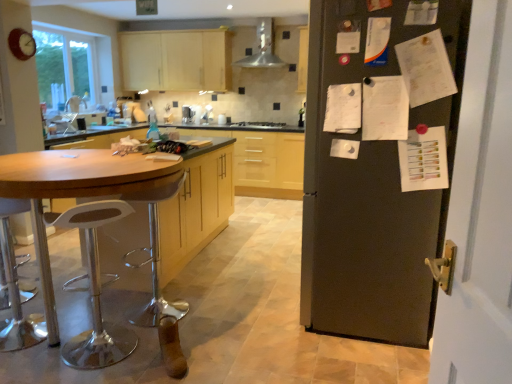
Where is `free location to the left of white plastic bar stool at left, the first bar stool in the front-to-back sequence`? The image size is (512, 384). free location to the left of white plastic bar stool at left, the first bar stool in the front-to-back sequence is located at coordinates (39, 349).